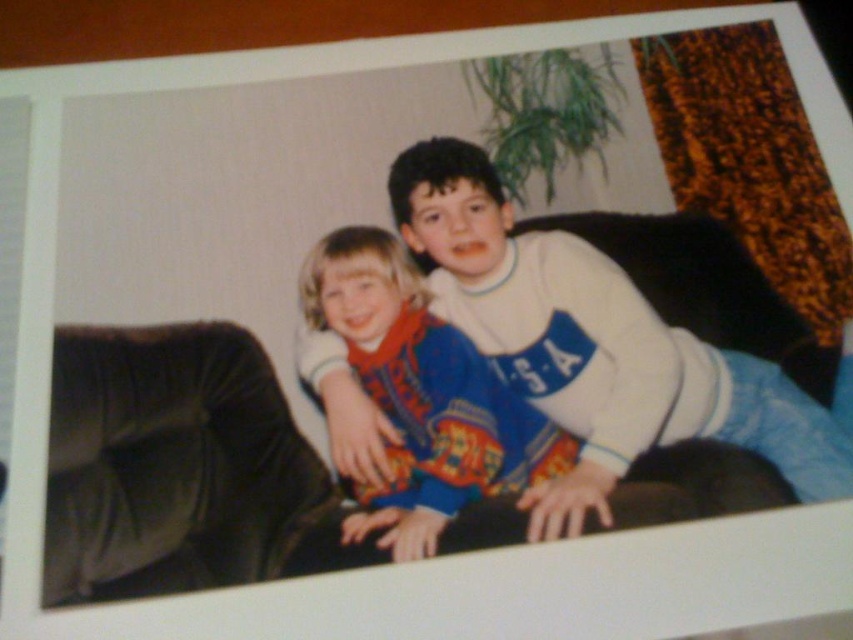
Is white cotton shirt at center further to camera compared to blue cotton shirt at center?

Yes.

Does white cotton shirt at center have a larger size compared to blue cotton shirt at center?

Correct, white cotton shirt at center is larger in size than blue cotton shirt at center.

Is point (767, 452) closer to camera compared to point (416, 516)?

No, (767, 452) is behind (416, 516).

At what (x,y) coordinates should I click in order to perform the action: click on white cotton shirt at center. Please return your answer as a coordinate pair (x, y). Looking at the image, I should click on (532, 268).

Is velvet brown couch at center taller than white cotton shirt at center?

No.

Is velvet brown couch at center bigger than white cotton shirt at center?

Correct, velvet brown couch at center is larger in size than white cotton shirt at center.

Is point (141, 477) in front of point (618, 340)?

Yes, it is in front of point (618, 340).

Locate an element on the screen. velvet brown couch at center is located at coordinates (178, 467).

Is velvet brown couch at center smaller than blue cotton shirt at center?

No.

Who is shorter, velvet brown couch at center or blue cotton shirt at center?

Standing shorter between the two is blue cotton shirt at center.

Which is in front, point (196, 529) or point (354, 257)?

Point (196, 529)

The image size is (853, 640). What are the coordinates of `velvet brown couch at center` in the screenshot? It's located at (178, 467).